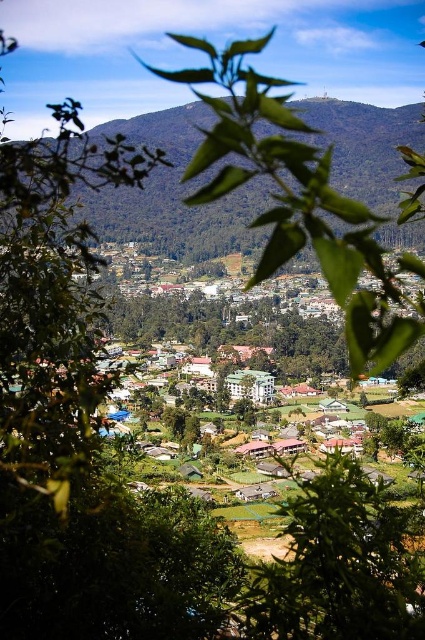
Question: Which of the following is the closest to the observer?

Choices:
 (A) green leafy tree at center
 (B) green leafy mountain at center

Answer: (A)

Question: Is green leafy mountain at center thinner than green leafy tree at center?

Choices:
 (A) no
 (B) yes

Answer: (A)

Question: Which point is closer to the camera taking this photo?

Choices:
 (A) (365, 129)
 (B) (334, 589)

Answer: (B)

Question: Does green leafy mountain at center appear under green leafy tree at center?

Choices:
 (A) yes
 (B) no

Answer: (B)

Question: Which point is farther from the camera taking this photo?

Choices:
 (A) (308, 541)
 (B) (112, 129)

Answer: (B)

Question: Does green leafy mountain at center appear under green leafy tree at center?

Choices:
 (A) no
 (B) yes

Answer: (A)